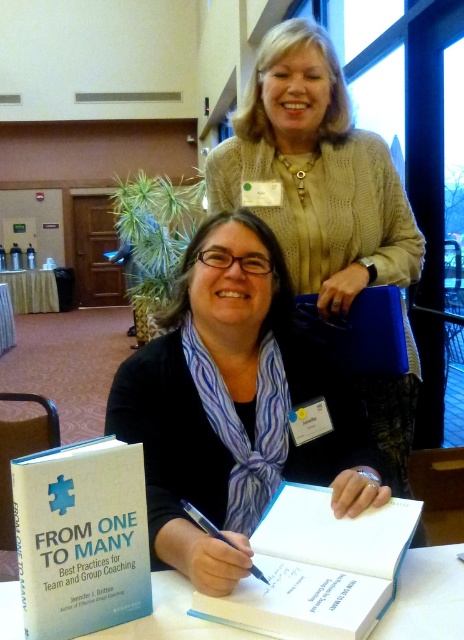
You are organizing a book signing event and need to place a 1.5 meter long banner between the knitted beige sweater at upper center and the white tablecloth at lower left. Is there enough space to fit the banner horizontally between them?

The knitted beige sweater at upper center and white tablecloth at lower left are 10.12 meters apart, so there is sufficient space to place a 1.5 meter long banner horizontally between them.

You are attending a book signing event and notice the white paper at center and the black metallic pen at center on the table. Which item is wider?

The white paper at center is wider than the black metallic pen at center.